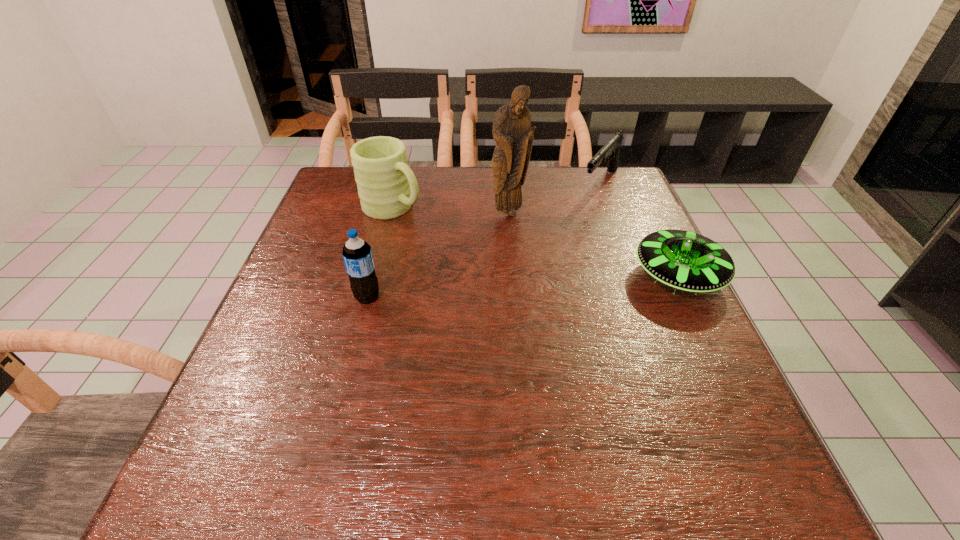
The image size is (960, 540). What are the coordinates of `soda bottle` in the screenshot? It's located at (357, 255).

Locate an element on the screen. saucer is located at coordinates (686, 261).

Locate an element on the screen. The image size is (960, 540). figurine is located at coordinates (511, 130).

Find the location of a particular element. the third object from left to right is located at coordinates (511, 130).

This screenshot has height=540, width=960. Identify the location of gun. (610, 151).

This screenshot has width=960, height=540. In order to click on mug in this screenshot , I will do `click(387, 187)`.

Image resolution: width=960 pixels, height=540 pixels. I want to click on blank space located on the back of the soda bottle, so click(x=377, y=262).

Locate an element on the screen. This screenshot has width=960, height=540. vacant region located 0.100m on the left of the shortest object is located at coordinates (589, 276).

The height and width of the screenshot is (540, 960). I want to click on vacant space located on the front-facing side of the figurine, so click(x=528, y=280).

The height and width of the screenshot is (540, 960). I want to click on vacant space located on the front-facing side of the figurine, so click(532, 296).